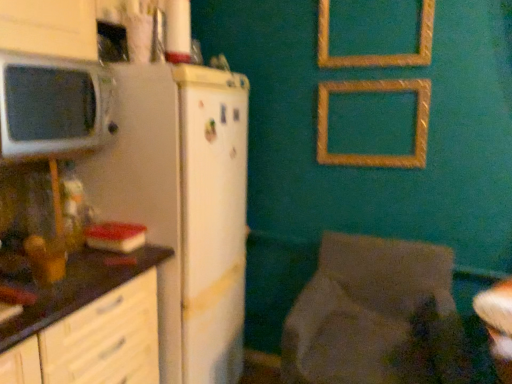
Question: Is dark brown laminate countertop at left oriented towards gold textured picture frame at upper center, which is the 2th picture frame from top to bottom?

Choices:
 (A) no
 (B) yes

Answer: (A)

Question: From the image's perspective, does dark brown laminate countertop at left appear lower than gold textured picture frame at upper center, which is counted as the 1th picture frame, starting from the bottom?

Choices:
 (A) yes
 (B) no

Answer: (A)

Question: Is gold textured picture frame at upper center, which is the 2th picture frame from top to bottom, at the back of dark brown laminate countertop at left?

Choices:
 (A) no
 (B) yes

Answer: (A)

Question: Can you confirm if dark brown laminate countertop at left is wider than gold textured picture frame at upper center, which is counted as the 1th picture frame, starting from the bottom?

Choices:
 (A) yes
 (B) no

Answer: (A)

Question: Can you confirm if dark brown laminate countertop at left is thinner than gold textured picture frame at upper center, which is counted as the 1th picture frame, starting from the bottom?

Choices:
 (A) yes
 (B) no

Answer: (B)

Question: Is dark brown laminate countertop at left not close to gold textured picture frame at upper center, which is counted as the 1th picture frame, starting from the bottom?

Choices:
 (A) yes
 (B) no

Answer: (A)

Question: Considering the relative sizes of gold textured picture frame at upper center, which is the 2th picture frame from top to bottom, and dark brown laminate countertop at left in the image provided, is gold textured picture frame at upper center, which is the 2th picture frame from top to bottom, wider than dark brown laminate countertop at left?

Choices:
 (A) no
 (B) yes

Answer: (A)

Question: Is gold textured picture frame at upper center, which is the 2th picture frame from top to bottom, at the right side of dark brown laminate countertop at left?

Choices:
 (A) yes
 (B) no

Answer: (A)

Question: Can you confirm if gold textured picture frame at upper center, which is the 2th picture frame from top to bottom, is positioned to the left of dark brown laminate countertop at left?

Choices:
 (A) yes
 (B) no

Answer: (B)

Question: From the image's perspective, would you say gold textured picture frame at upper center, which is counted as the 1th picture frame, starting from the bottom, is positioned over dark brown laminate countertop at left?

Choices:
 (A) yes
 (B) no

Answer: (A)

Question: Is gold textured picture frame at upper center, which is the 2th picture frame from top to bottom, bigger than dark brown laminate countertop at left?

Choices:
 (A) yes
 (B) no

Answer: (B)

Question: Is the position of gold textured picture frame at upper center, which is the 2th picture frame from top to bottom, more distant than that of dark brown laminate countertop at left?

Choices:
 (A) no
 (B) yes

Answer: (B)

Question: Is white matte refrigerator at left completely or partially inside textured fabric chair at lower right?

Choices:
 (A) yes
 (B) no

Answer: (B)